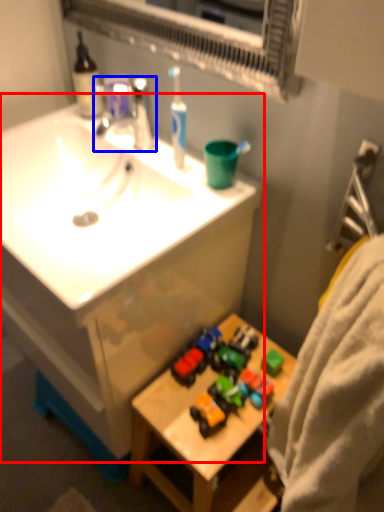
Question: Among these objects, which one is nearest to the camera, sink (highlighted by a red box) or tap (highlighted by a blue box)?

Choices:
 (A) sink
 (B) tap

Answer: (A)